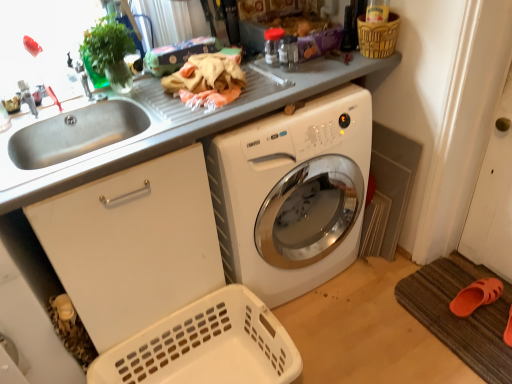
I want to click on vacant space underneath brown textured bath mat at lower right (from a real-world perspective), so click(448, 301).